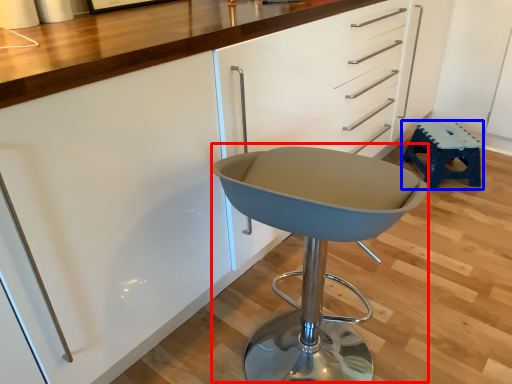
Question: Which point is closer to the camera, swivel chair (highlighted by a red box) or stool (highlighted by a blue box)?

Choices:
 (A) swivel chair
 (B) stool

Answer: (A)